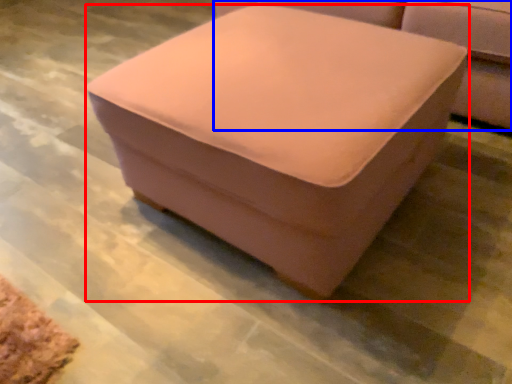
Question: Which of the following is the farthest to the observer, furniture (highlighted by a red box) or studio couch (highlighted by a blue box)?

Choices:
 (A) furniture
 (B) studio couch

Answer: (B)